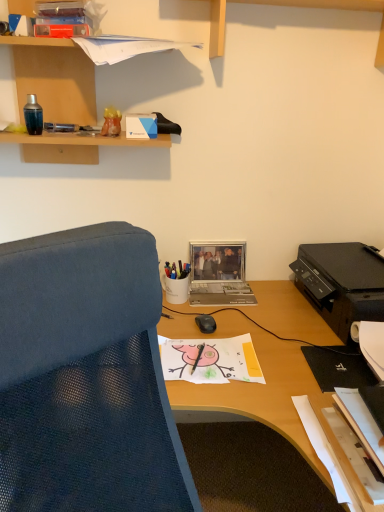
Question: Considering the relative positions of wooden shelf at upper left and translucent orange vase at upper left, marked as the second stationery in a bottom-to-top arrangement, in the image provided, is wooden shelf at upper left to the left or to the right of translucent orange vase at upper left, marked as the second stationery in a bottom-to-top arrangement,?

Choices:
 (A) right
 (B) left

Answer: (B)

Question: Is wooden shelf at upper left taller or shorter than translucent orange vase at upper left, positioned as the 2th stationery in right-to-left order?

Choices:
 (A) short
 (B) tall

Answer: (B)

Question: Based on their relative distances, which object is farther from the white glossy pen holder at center, which ranks as the second stationery in front-to-back order?

Choices:
 (A) metallic pen at upper left, the second pen from the bottom
 (B) wooden shelf at upper left
 (C) translucent orange vase at upper left, marked as the second stationery in a bottom-to-top arrangement
 (D) black plastic printer at right
 (E) black matte pen at center, which is the first pen in bottom-to-top order

Answer: (B)

Question: Which object is the farthest from the black matte pen at center, which is the second pen from left to right?

Choices:
 (A) wooden shelf at upper left
 (B) translucent orange vase at upper left, acting as the 1th stationery starting from the left
 (C) black plastic printer at right
 (D) white glossy pen holder at center, which ranks as the second stationery in front-to-back order
 (E) metallic pen at upper left, marked as the first pen in a top-to-bottom arrangement

Answer: (A)